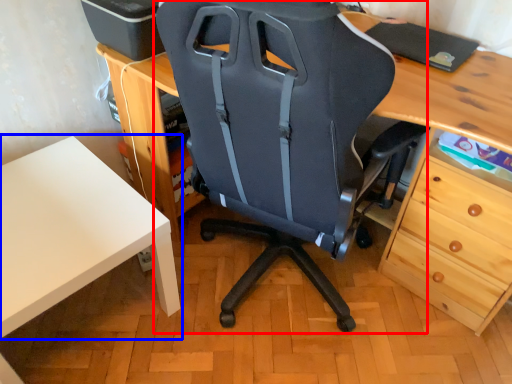
Question: Which of the following is the farthest to the observer, chair (highlighted by a red box) or table (highlighted by a blue box)?

Choices:
 (A) chair
 (B) table

Answer: (B)